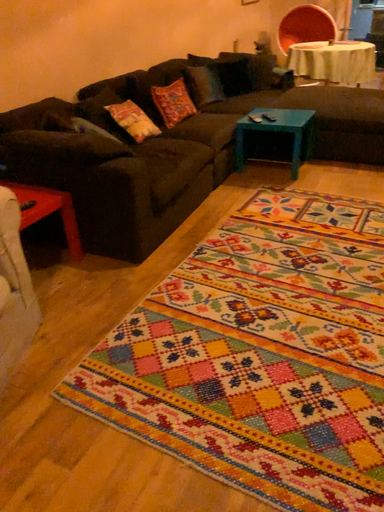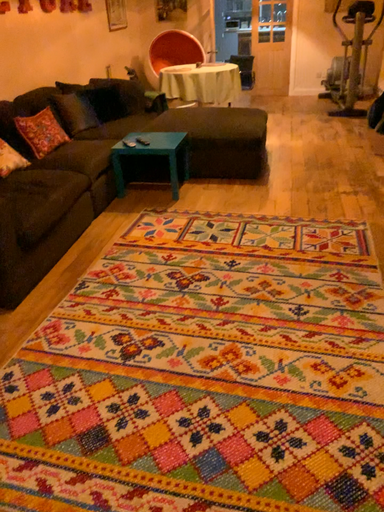
Question: Which way did the camera rotate in the video?

Choices:
 (A) rotated left
 (B) rotated right

Answer: (B)